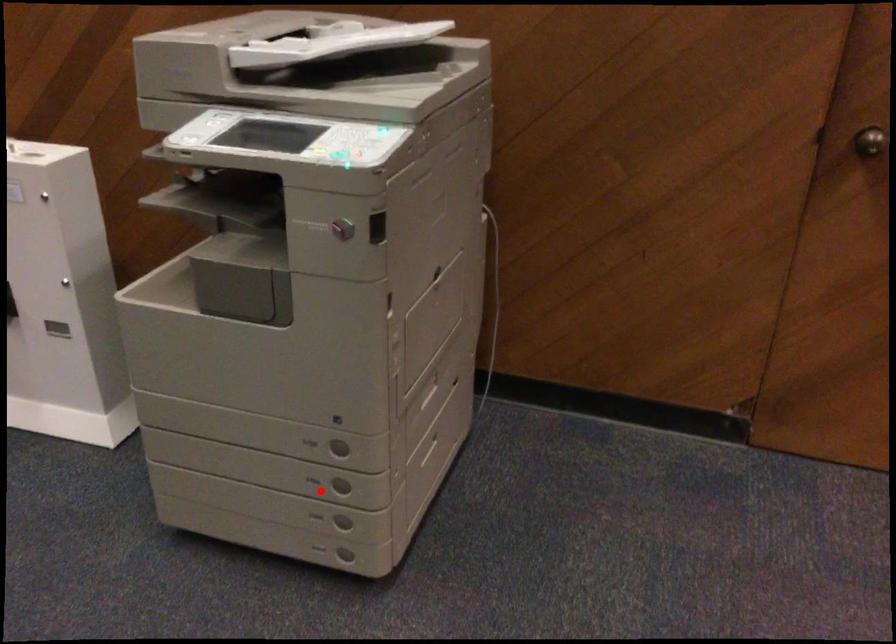
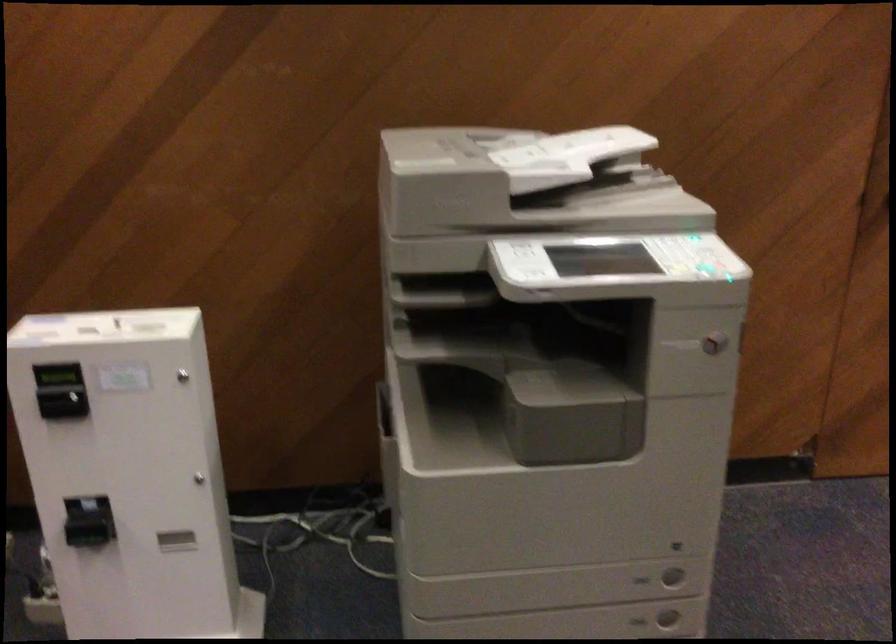
Locate, in the second image, the point that corresponds to the highlighted location in the first image.

(638, 621)